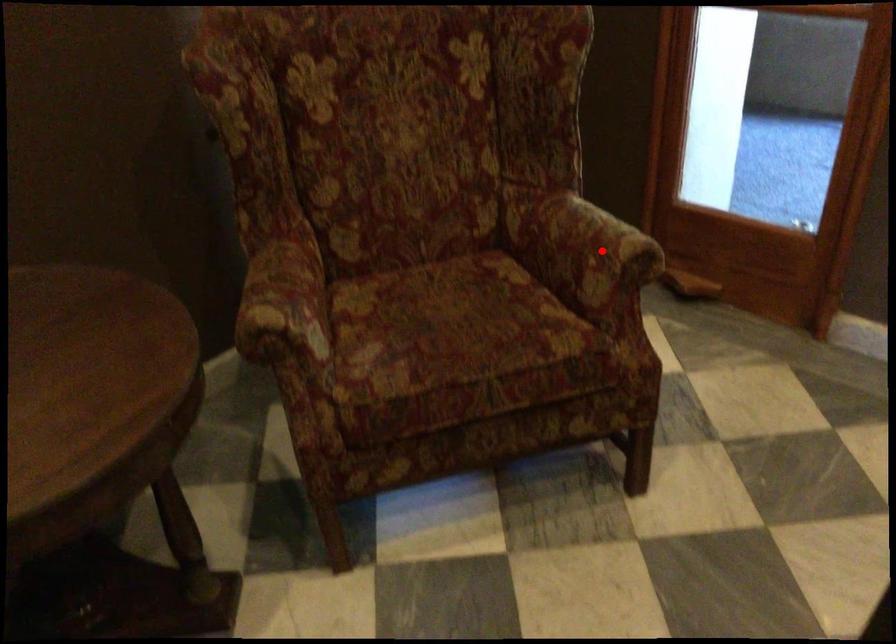
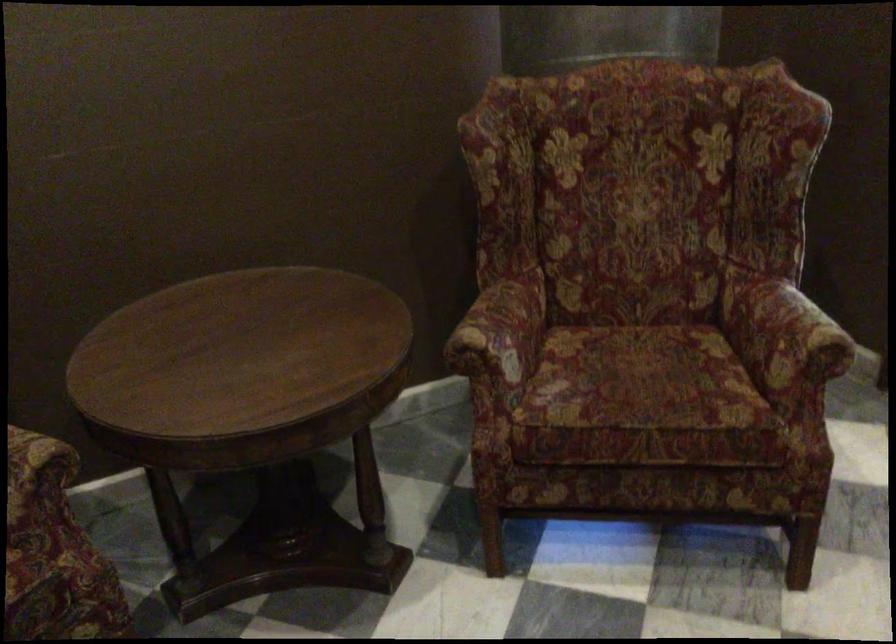
In the second image, find the point that corresponds to the highlighted location in the first image.

(793, 337)